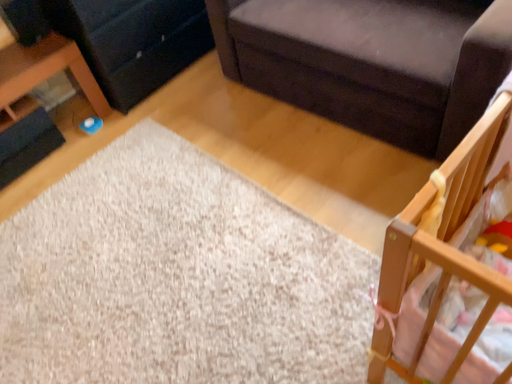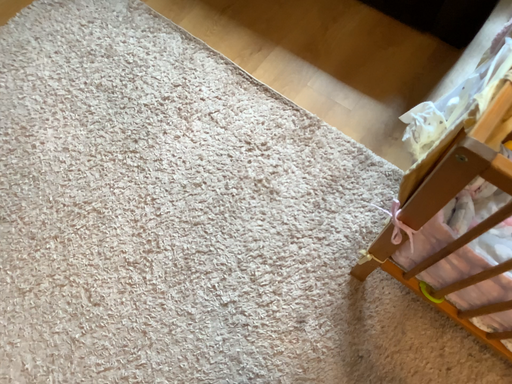
Question: How did the camera likely rotate when shooting the video?

Choices:
 (A) rotated downward
 (B) rotated upward

Answer: (A)